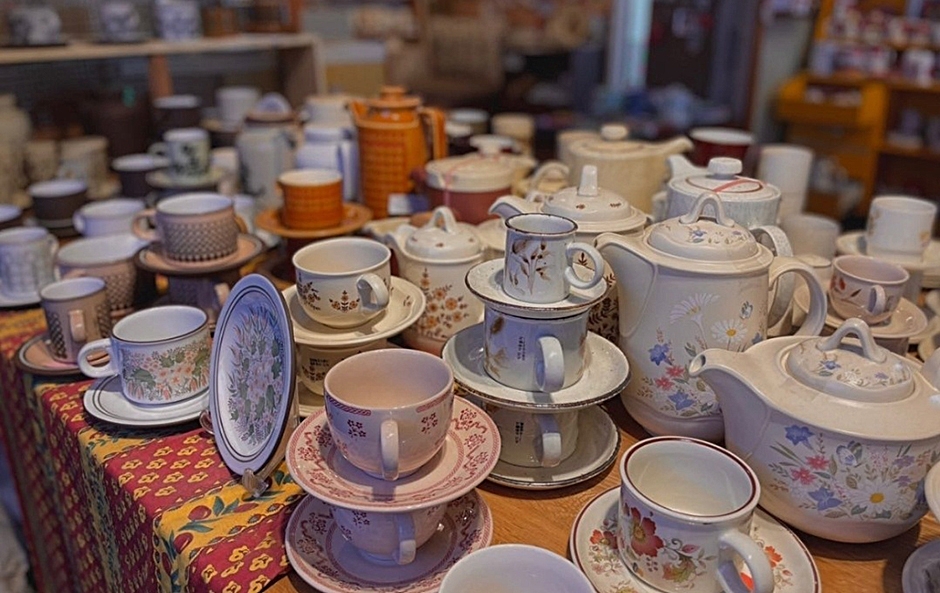
Find the location of a particular element. vintage teapot lid is located at coordinates (848, 368), (705, 232), (585, 202), (431, 240), (388, 94), (617, 144), (719, 180).